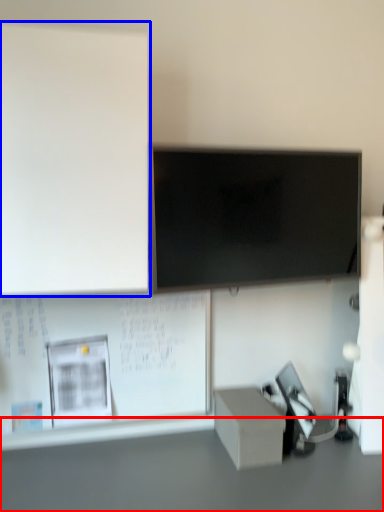
Question: Which object is closer to the camera taking this photo, table (highlighted by a red box) or bulletin board (highlighted by a blue box)?

Choices:
 (A) table
 (B) bulletin board

Answer: (A)